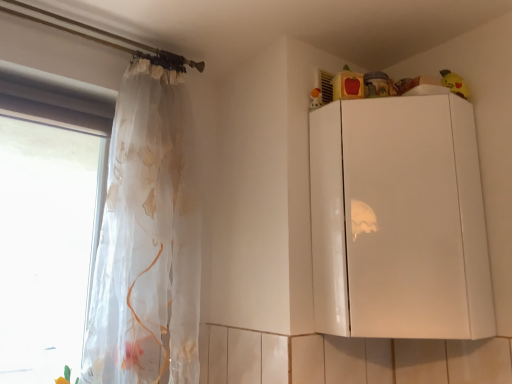
Question: Considering the positions of matte orange toy at upper right, the second toy viewed from the right, and white glossy cabinet at upper right in the image, is matte orange toy at upper right, the second toy viewed from the right, taller or shorter than white glossy cabinet at upper right?

Choices:
 (A) short
 (B) tall

Answer: (A)

Question: Based on their positions, is matte orange toy at upper right, which appears as the first toy when viewed from the left, located to the left or right of white glossy cabinet at upper right?

Choices:
 (A) left
 (B) right

Answer: (A)

Question: Based on their relative distances, which object is nearer to the transparent fabric at left?

Choices:
 (A) yellow plush toy at upper right, which appears as the 1th toy when viewed from the right
 (B) matte orange toy at upper right, which appears as the first toy when viewed from the left
 (C) translucent floral fabric at left
 (D) white glossy cabinet at upper right

Answer: (C)

Question: Which object is the farthest from the matte orange toy at upper right, the second toy viewed from the right?

Choices:
 (A) white glossy cabinet at upper right
 (B) translucent floral fabric at left
 (C) yellow plush toy at upper right, positioned as the 2th toy in left-to-right order
 (D) transparent fabric at left

Answer: (D)